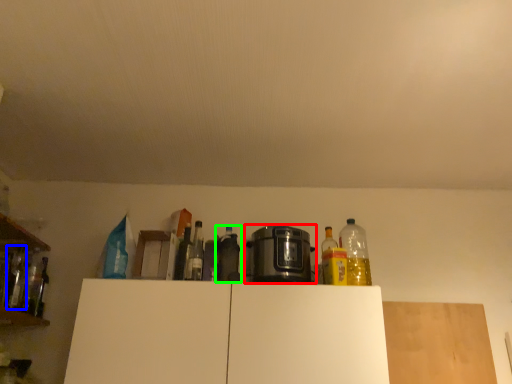
Question: Which is nearer to the home appliance (highlighted by a red box)? bottle (highlighted by a blue box) or bottle (highlighted by a green box).

Choices:
 (A) bottle
 (B) bottle

Answer: (B)